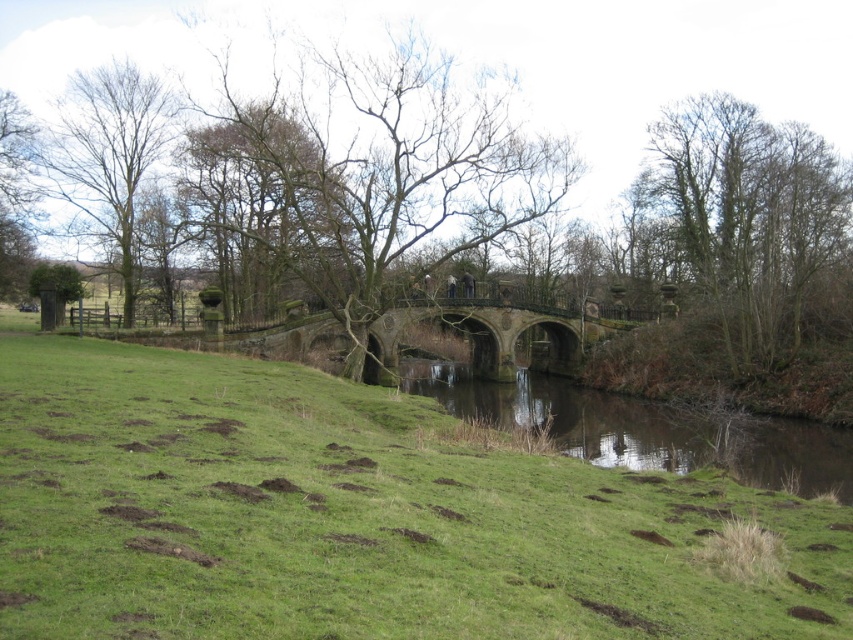
Can you confirm if bare branches at center is smaller than rusty stone bridge at center?

No.

Is bare branches at center behind rusty stone bridge at center?

No, it is not.

Is point (352, 227) behind point (355, 346)?

That is True.

Identify the location of bare branches at center. The height and width of the screenshot is (640, 853). (378, 173).

Can you confirm if bare branches at center is positioned above bare wood tree at left?

Yes.

Can you confirm if bare branches at center is shorter than bare wood tree at left?

Correct, bare branches at center is not as tall as bare wood tree at left.

The image size is (853, 640). What are the coordinates of `bare branches at center` in the screenshot? It's located at (378, 173).

How much distance is there between green grassy at center and rusty stone bridge at center?

green grassy at center is 96.08 feet from rusty stone bridge at center.

Is point (227, 472) behind point (509, 308)?

No, (227, 472) is closer to viewer.

Find the location of a particular element. The height and width of the screenshot is (640, 853). green grassy at center is located at coordinates (363, 516).